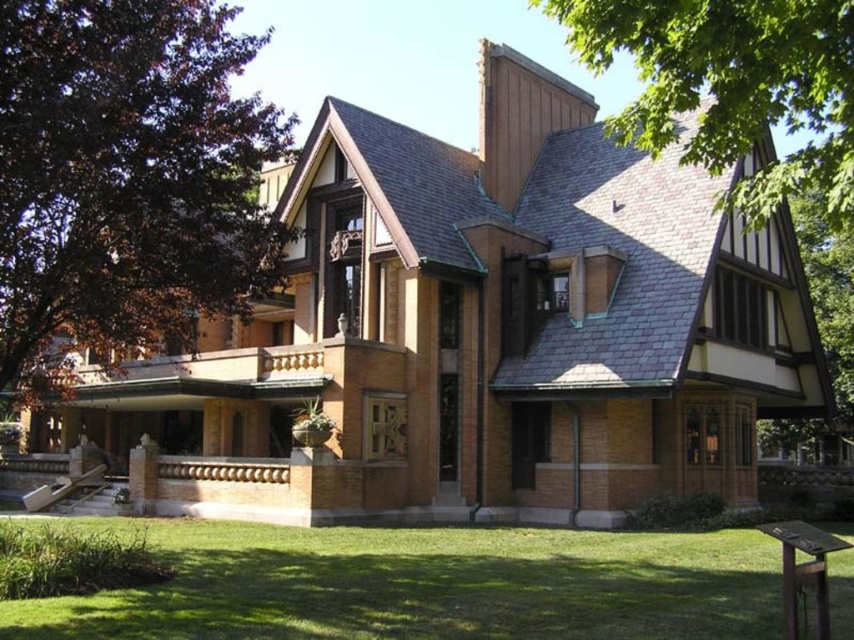
You are standing in front of the historic house and notice a specific feature at the coordinates point (126,180). Based on the scene description, what material is located at this point?

The point (126,180) indicates dark brown wood at upper left, so the material at this location is dark brown wood.

You are standing on the porch of the historic house and want to plant a new flower bed. You notice the green grass at lower center and the green leafy tree at upper right. Which object is closer to you, the observer, based on their positions?

The green grass at lower center is closer to you because it is located below the green leafy tree at upper right, placing it nearer in the visual perspective.

You are standing in front of the historic house and want to determine which of the two points, point (21, 269) or point (647, 131), is closer to you. Based on the house structure, which point is nearer?

Point (21, 269) is closer to the viewer than point (647, 131).